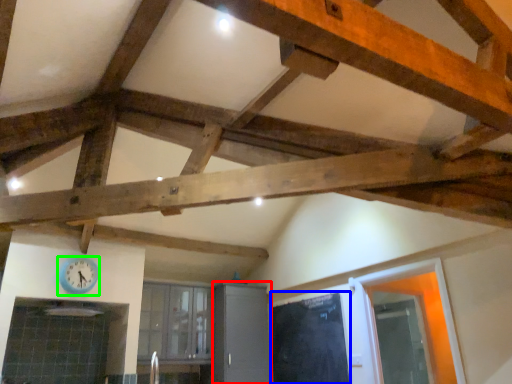
Question: Considering the real-world distances, which object is farthest from cabinetry (highlighted by a red box)? door (highlighted by a blue box) or clock (highlighted by a green box)?

Choices:
 (A) door
 (B) clock

Answer: (B)